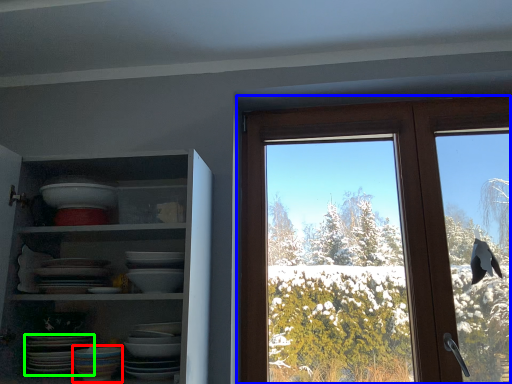
Question: Which is nearer to the tableware (highlighted by a red box)? window (highlighted by a blue box) or platter (highlighted by a green box).

Choices:
 (A) window
 (B) platter

Answer: (B)